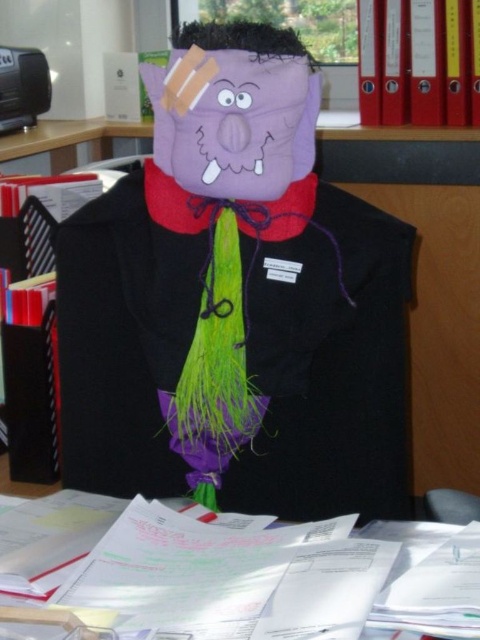
You are an artist trying to create a new design for a Halloween costume. You have two masks available in front of you, a matte purple mask at center and a purple felt mask at center. Which mask should you choose if you want the mask to cover more of the face?

The matte purple mask at center has a larger size compared to the purple felt mask at center, so you should choose the matte purple mask at center to cover more of the face.

You are an artist who wants to draw the scene from the image. You see the white paper at lower center and the purple felt mask at center. Which object should you draw first to ensure proper layering?

You should draw the purple felt mask at center first because the white paper at lower center is in front of it, so drawing the mask first allows you to layer the paper over it correctly.